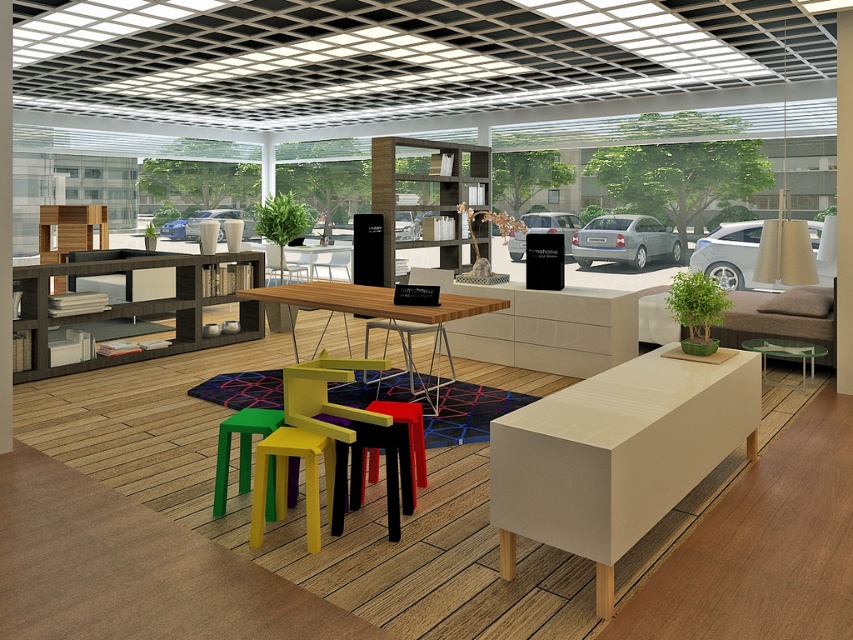
You are standing in the showroom and want to sit down. You see a yellow matte chair at center and a yellow matte bar stool at center. Which one is closer to you?

The yellow matte chair at center is closer to you because it is further to the viewer than the yellow matte bar stool at center.

You are standing at the entrance of the showroom and see the yellow matte bar stool at center and the matte black stool at center. Which one is closer to you?

The yellow matte bar stool at center is closer to you because it is in front of the matte black stool at center.